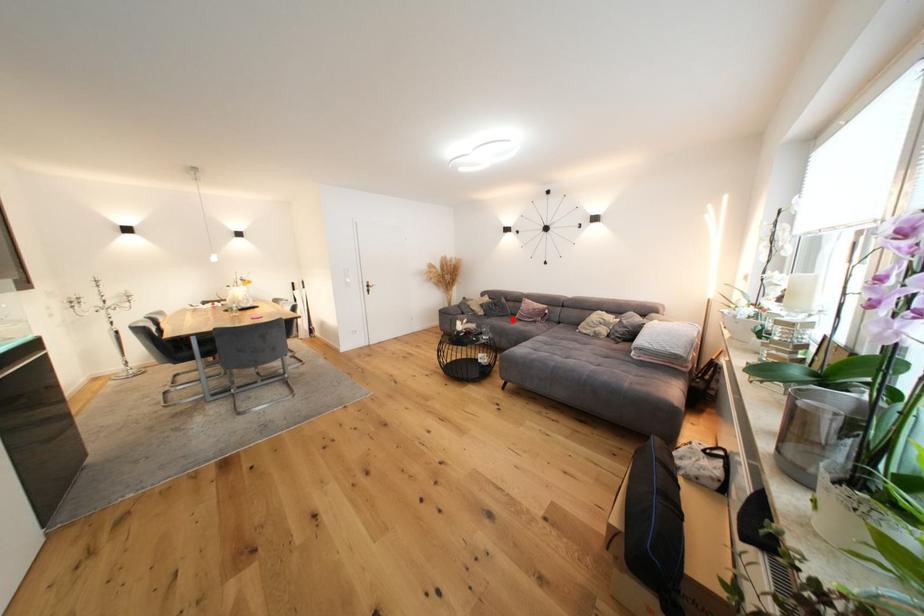
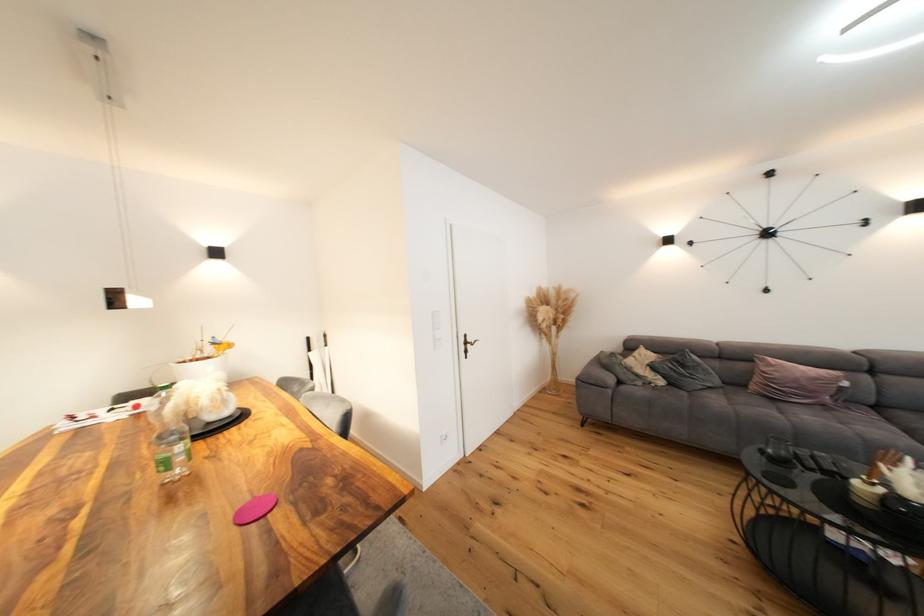
Locate, in the second image, the point that corresponds to the highlighted location in the first image.

(727, 392)